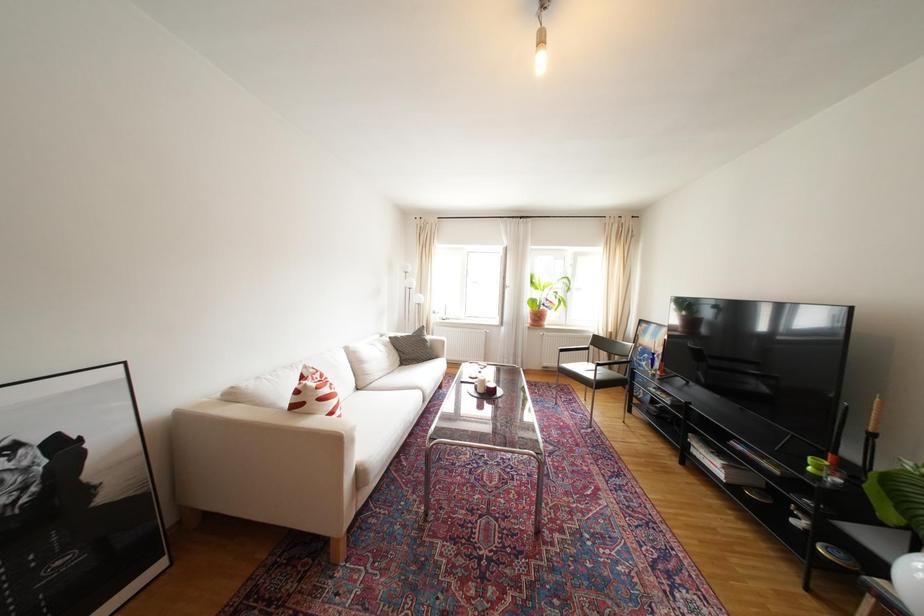
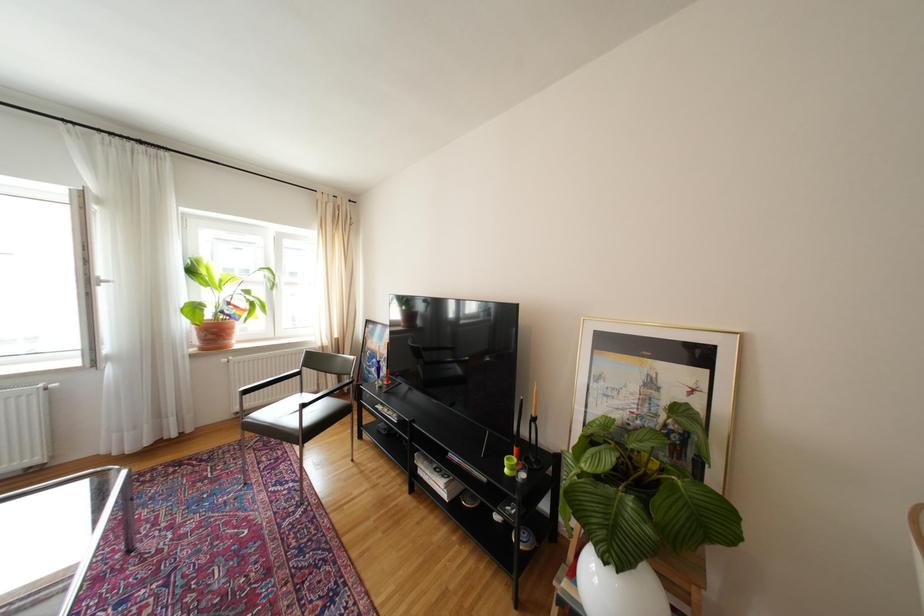
Question: How did the camera likely rotate?

Choices:
 (A) Left
 (B) Right
 (C) Up
 (D) Down

Answer: (B)